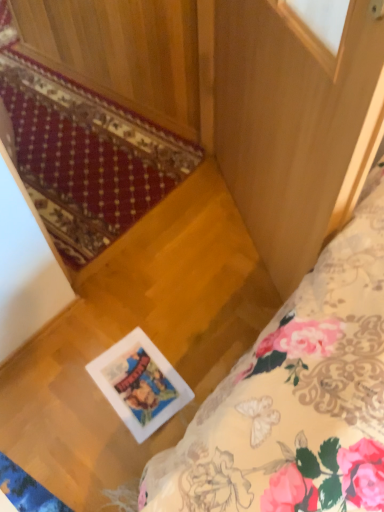
Question: Which is correct: white glossy picture frame at center is inside wooden screen door at center, or outside of it?

Choices:
 (A) outside
 (B) inside

Answer: (A)

Question: From the image's perspective, relative to wooden screen door at center, is white glossy picture frame at center above or below?

Choices:
 (A) below
 (B) above

Answer: (A)

Question: Considering the real-world distances, which object is closest to the white glossy picture frame at center?

Choices:
 (A) floral fabric bed at lower right
 (B) wooden screen door at center
 (C) red carpet at lower left

Answer: (A)

Question: Which object is positioned farthest from the floral fabric bed at lower right?

Choices:
 (A) wooden screen door at center
 (B) red carpet at lower left
 (C) white glossy picture frame at center

Answer: (B)